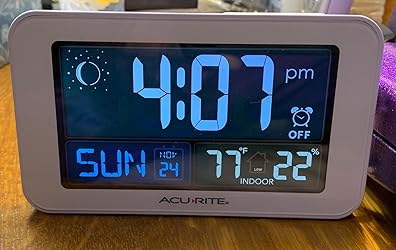
At what (x,y) coordinates should I click in order to perform the action: click on alarm. Please return your answer as a coordinate pair (x, y). Looking at the image, I should click on (294, 120).